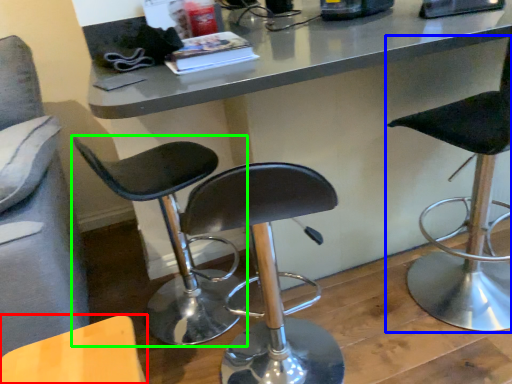
Question: Estimate the real-world distances between objects in this image. Which object is farther from chair (highlighted by a red box), chair (highlighted by a blue box) or chair (highlighted by a green box)?

Choices:
 (A) chair
 (B) chair

Answer: (A)